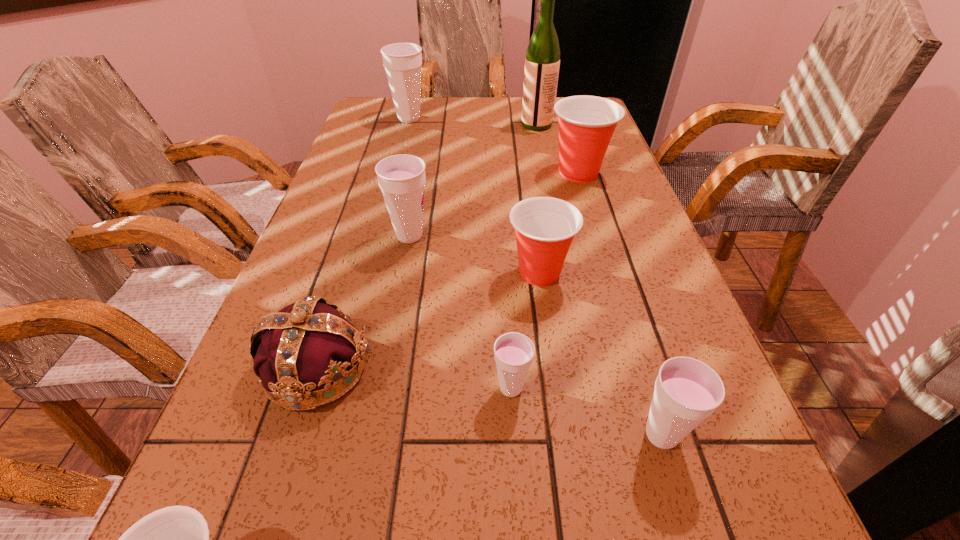
This screenshot has width=960, height=540. What are the coordinates of `vacant position at the far edge of the desktop` in the screenshot? It's located at (438, 114).

This screenshot has width=960, height=540. In order to click on vacant region at the left edge of the desktop in this screenshot , I will do [x=334, y=229].

The height and width of the screenshot is (540, 960). In the image, there is a desktop. Identify the location of free space at the right edge. (637, 227).

I want to click on blank region between the third nearest cup and the eighth shortest object, so click(x=460, y=253).

Identify the location of free space between the third nearest cup and the rightmost purple cup. (587, 411).

Identify the location of free space between the farthest cup and the biggest red cup. (493, 146).

Identify the location of free space between the nearest purple cup and the second farthest cup. The height and width of the screenshot is (540, 960). (620, 304).

What are the coordinates of `unoccupied position between the second nearest red cup and the purple crown` in the screenshot? It's located at (428, 320).

Where is `the seventh closest object to the nearest cup`? The width and height of the screenshot is (960, 540). the seventh closest object to the nearest cup is located at coordinates (402, 61).

Locate which object is the fourth closest to the tallest cup. Please provide its 2D coordinates. Your answer should be formatted as a tuple, i.e. [(x, y)], where the tuple contains the x and y coordinates of a point satisfying the conditions above.

[(544, 226)]